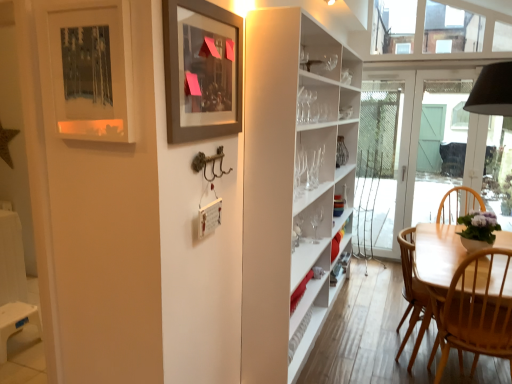
Question: Which direction should I rotate to look at matte gray picture frame at upper center, which is the first picture frame in right-to-left order?

Choices:
 (A) right
 (B) left

Answer: (B)

Question: Is white glass door at center placed right next to light wood chair at lower right?

Choices:
 (A) no
 (B) yes

Answer: (A)

Question: Can you confirm if white glass door at center is bigger than light wood chair at lower right?

Choices:
 (A) no
 (B) yes

Answer: (A)

Question: From a real-world perspective, is white glass door at center on top of light wood chair at lower right?

Choices:
 (A) yes
 (B) no

Answer: (A)

Question: Is white glass door at center located outside light wood chair at lower right?

Choices:
 (A) yes
 (B) no

Answer: (A)

Question: Does white glass door at center have a greater width compared to light wood chair at lower right?

Choices:
 (A) yes
 (B) no

Answer: (B)

Question: Is white glass door at center facing away from light wood chair at lower right?

Choices:
 (A) yes
 (B) no

Answer: (B)

Question: From the image's perspective, is matte black picture frame at upper left, which ranks as the 2th picture frame in right-to-left order, over light wood chair at lower right?

Choices:
 (A) yes
 (B) no

Answer: (A)

Question: Does matte black picture frame at upper left, which ranks as the 2th picture frame in right-to-left order, touch light wood chair at lower right?

Choices:
 (A) yes
 (B) no

Answer: (B)

Question: From a real-world perspective, is matte black picture frame at upper left, which ranks as the 2th picture frame in right-to-left order, positioned over light wood chair at lower right based on gravity?

Choices:
 (A) no
 (B) yes

Answer: (B)

Question: Considering the relative sizes of matte black picture frame at upper left, which is counted as the first picture frame, starting from the left, and light wood chair at lower right in the image provided, is matte black picture frame at upper left, which is counted as the first picture frame, starting from the left, bigger than light wood chair at lower right?

Choices:
 (A) no
 (B) yes

Answer: (A)

Question: Is matte black picture frame at upper left, which ranks as the 2th picture frame in right-to-left order, oriented away from light wood chair at lower right?

Choices:
 (A) no
 (B) yes

Answer: (A)

Question: From the image's perspective, is matte black picture frame at upper left, which ranks as the 2th picture frame in right-to-left order, located beneath light wood chair at lower right?

Choices:
 (A) no
 (B) yes

Answer: (A)

Question: Is light wood chair at lower right looking in the opposite direction of matte black picture frame at upper left, which ranks as the 2th picture frame in right-to-left order?

Choices:
 (A) yes
 (B) no

Answer: (B)